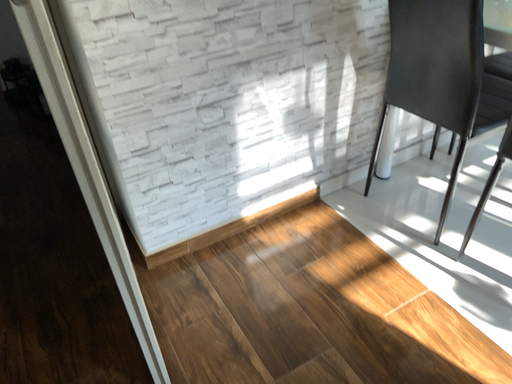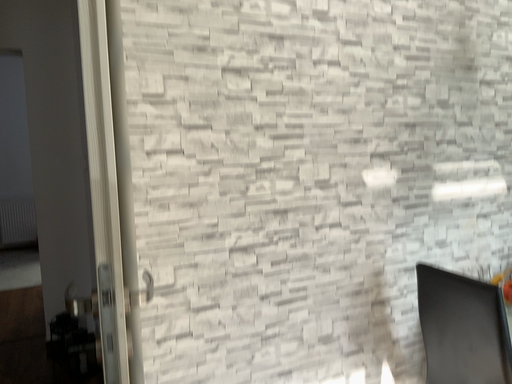
Question: How did the camera likely rotate when shooting the video?

Choices:
 (A) rotated upward
 (B) rotated downward

Answer: (A)